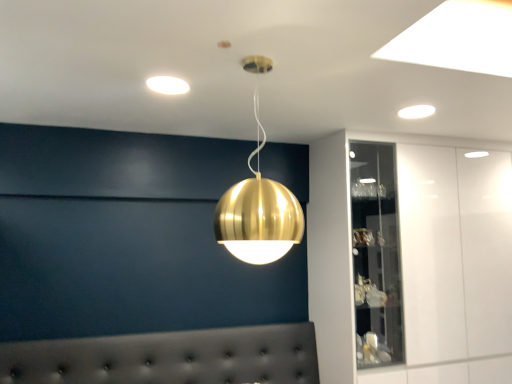
Question: Is white glossy light fixture at upper right, the second lamp when ordered from bottom to top, positioned beyond the bounds of matte white light fixture at upper center, which is the third lamp from right to left?

Choices:
 (A) no
 (B) yes

Answer: (B)

Question: Considering the relative sizes of white glossy light fixture at upper right, acting as the first lamp starting from the right, and matte white light fixture at upper center, placed as the first lamp when sorted from left to right, in the image provided, is white glossy light fixture at upper right, acting as the first lamp starting from the right, thinner than matte white light fixture at upper center, placed as the first lamp when sorted from left to right,?

Choices:
 (A) no
 (B) yes

Answer: (B)

Question: Is white glossy light fixture at upper right, the first lamp viewed from the back, shorter than matte white light fixture at upper center, which is the third lamp from right to left?

Choices:
 (A) no
 (B) yes

Answer: (A)

Question: Is white glossy light fixture at upper right, acting as the third lamp starting from the front, looking in the opposite direction of matte white light fixture at upper center, positioned as the third lamp in bottom-to-top order?

Choices:
 (A) no
 (B) yes

Answer: (A)

Question: Is white glossy light fixture at upper right, acting as the third lamp starting from the front, wider than matte white light fixture at upper center, which is the third lamp from right to left?

Choices:
 (A) yes
 (B) no

Answer: (B)

Question: Is the surface of white glossy light fixture at upper right, the first lamp viewed from the back, in direct contact with matte white light fixture at upper center, placed as the first lamp when sorted from left to right?

Choices:
 (A) no
 (B) yes

Answer: (A)

Question: Is there a large distance between white glossy light fixture at upper right, which is counted as the 2th lamp, starting from the top, and white glossy cabinet at upper right?

Choices:
 (A) yes
 (B) no

Answer: (A)

Question: Is white glossy light fixture at upper right, acting as the third lamp starting from the front, outside of white glossy cabinet at upper right?

Choices:
 (A) yes
 (B) no

Answer: (A)

Question: Is white glossy light fixture at upper right, acting as the first lamp starting from the right, to the left of white glossy cabinet at upper right from the viewer's perspective?

Choices:
 (A) no
 (B) yes

Answer: (B)

Question: Considering the relative sizes of white glossy light fixture at upper right, which is counted as the 2th lamp, starting from the top, and white glossy cabinet at upper right in the image provided, is white glossy light fixture at upper right, which is counted as the 2th lamp, starting from the top, wider than white glossy cabinet at upper right?

Choices:
 (A) yes
 (B) no

Answer: (B)

Question: Can you confirm if white glossy light fixture at upper right, which is counted as the 2th lamp, starting from the top, is bigger than white glossy cabinet at upper right?

Choices:
 (A) no
 (B) yes

Answer: (A)

Question: From a real-world perspective, is white glossy light fixture at upper right, positioned as the third lamp in left-to-right order, physically below white glossy cabinet at upper right?

Choices:
 (A) no
 (B) yes

Answer: (A)

Question: Does white glossy cabinet at upper right have a lesser width compared to tufted leather headboard at lower center?

Choices:
 (A) no
 (B) yes

Answer: (A)